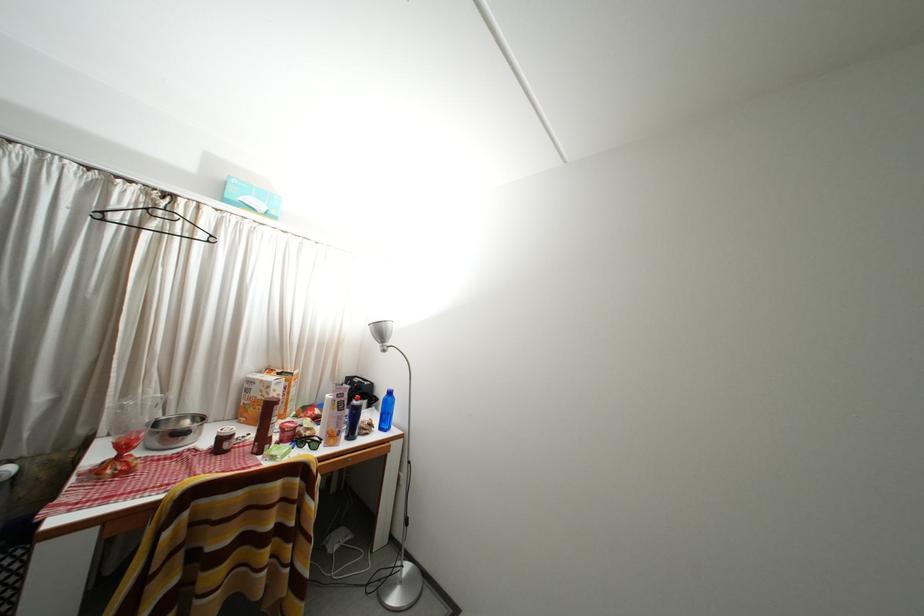
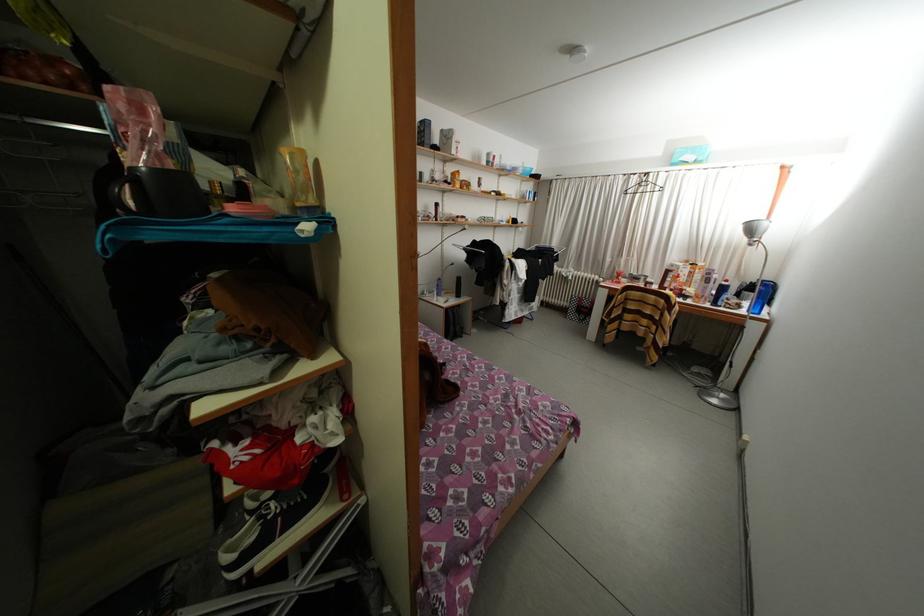
Question: I am providing you with two images of the same scene from different viewpoints. Please identify which objects are invisible in image2.

Choices:
 (A) blue bowl
 (B) red bottle cap
 (C) blue spray bottle
 (D) white plastic bottle

Answer: (B)